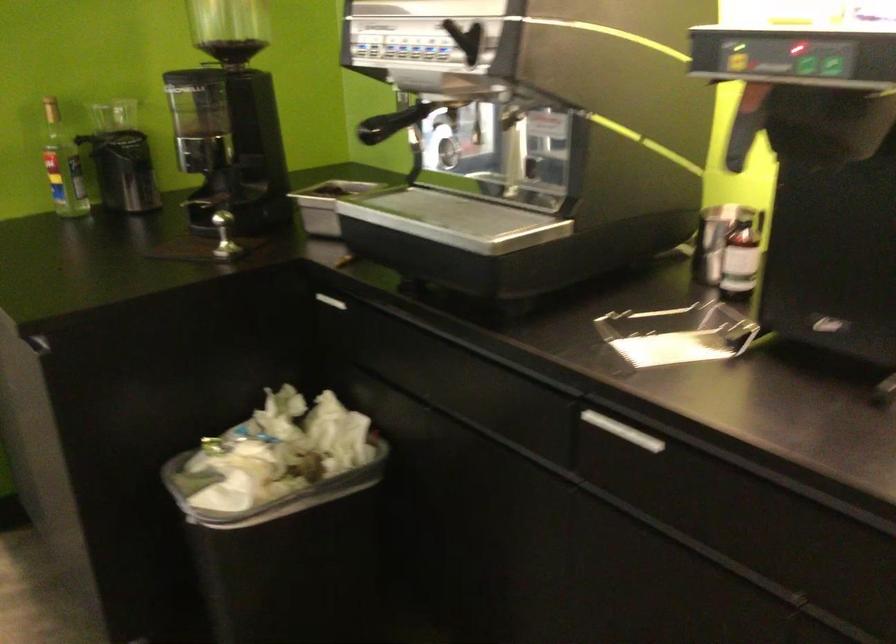
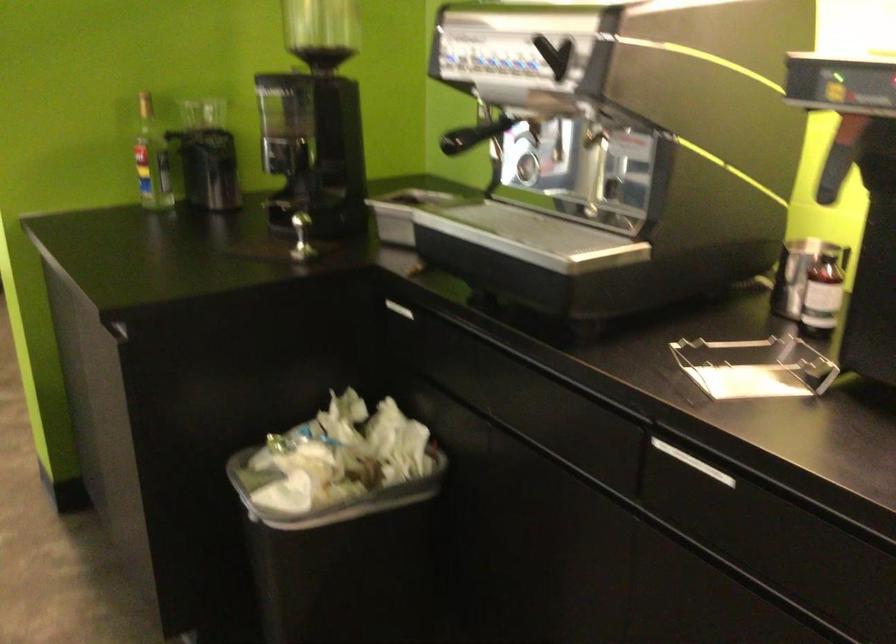
The point at (x=738, y=261) is marked in the first image. Where is the corresponding point in the second image?

(822, 294)